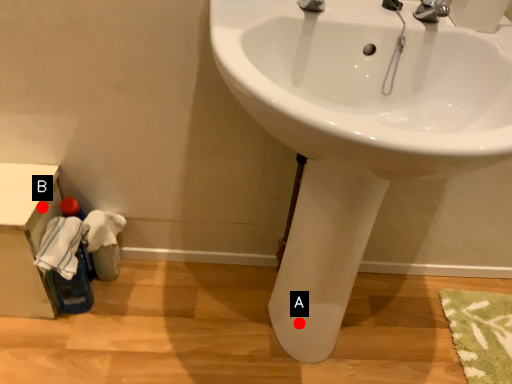
Question: Two points are circled on the image, labeled by A and B beside each circle. Among these points, which one is nearest to the camera?

Choices:
 (A) A is closer
 (B) B is closer

Answer: (B)